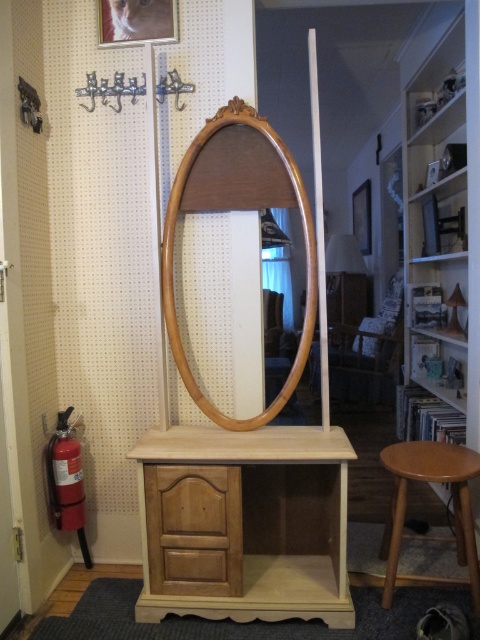
Question: Does light wood vanity at center appear on the right side of light brown wooden stool at lower right?

Choices:
 (A) no
 (B) yes

Answer: (A)

Question: Which point is closer to the camera taking this photo?

Choices:
 (A) coord(166,310)
 (B) coord(219,589)

Answer: (B)

Question: Which point is farther to the camera?

Choices:
 (A) (271, 184)
 (B) (384, 456)
 (C) (192, 532)

Answer: (A)

Question: From the image, what is the correct spatial relationship of wooden mirror at center in relation to light brown wood drawer at center?

Choices:
 (A) right
 (B) left

Answer: (A)

Question: Which object is closer to the camera taking this photo?

Choices:
 (A) light brown wooden stool at lower right
 (B) wooden mirror at center
 (C) light brown wood drawer at center
 (D) light wood vanity at center

Answer: (D)

Question: Is light brown wood drawer at center smaller than light brown wooden stool at lower right?

Choices:
 (A) no
 (B) yes

Answer: (B)